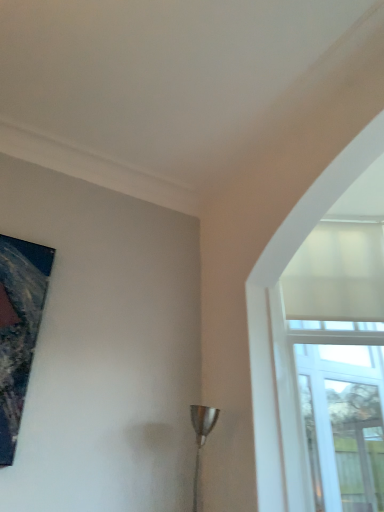
Question: Can you confirm if metallic silver lamp at lower center is taller than metallic painting at upper left?

Choices:
 (A) no
 (B) yes

Answer: (A)

Question: Is metallic silver lamp at lower center wider than metallic painting at upper left?

Choices:
 (A) no
 (B) yes

Answer: (B)

Question: Is metallic silver lamp at lower center touching metallic painting at upper left?

Choices:
 (A) yes
 (B) no

Answer: (B)

Question: Is there a large distance between metallic silver lamp at lower center and metallic painting at upper left?

Choices:
 (A) no
 (B) yes

Answer: (B)

Question: Does metallic silver lamp at lower center lie behind metallic painting at upper left?

Choices:
 (A) yes
 (B) no

Answer: (A)

Question: From the image's perspective, would you say metallic silver lamp at lower center is shown under metallic painting at upper left?

Choices:
 (A) no
 (B) yes

Answer: (B)

Question: Considering the relative positions of metallic painting at upper left and metallic silver lamp at lower center in the image provided, is metallic painting at upper left to the left of metallic silver lamp at lower center from the viewer's perspective?

Choices:
 (A) no
 (B) yes

Answer: (B)

Question: Is metallic painting at upper left beside metallic silver lamp at lower center?

Choices:
 (A) no
 (B) yes

Answer: (A)

Question: Is metallic painting at upper left facing away from metallic silver lamp at lower center?

Choices:
 (A) no
 (B) yes

Answer: (A)

Question: Considering the relative sizes of metallic painting at upper left and metallic silver lamp at lower center in the image provided, is metallic painting at upper left bigger than metallic silver lamp at lower center?

Choices:
 (A) yes
 (B) no

Answer: (B)

Question: Can you confirm if metallic painting at upper left is smaller than metallic silver lamp at lower center?

Choices:
 (A) no
 (B) yes

Answer: (B)

Question: Is metallic painting at upper left outside of metallic silver lamp at lower center?

Choices:
 (A) yes
 (B) no

Answer: (A)

Question: Is metallic silver lamp at lower center not within white matte glass window at upper right?

Choices:
 (A) no
 (B) yes

Answer: (B)